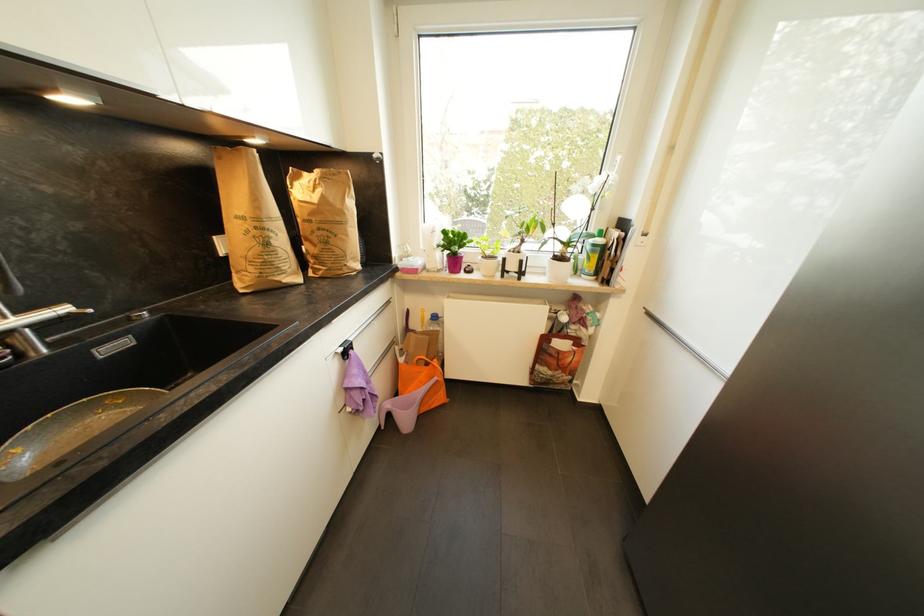
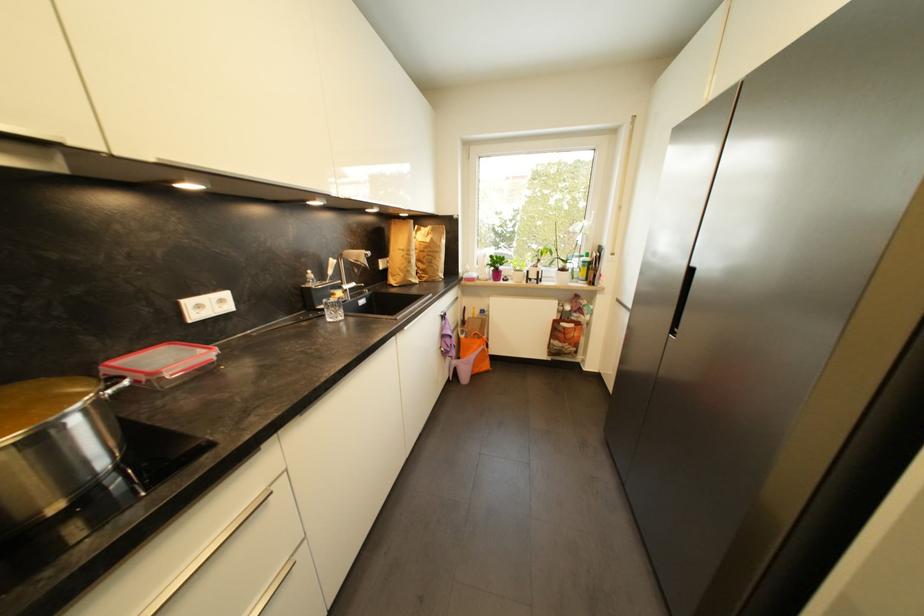
The point at (27,313) is marked in the first image. Where is the corresponding point in the second image?

(353, 285)